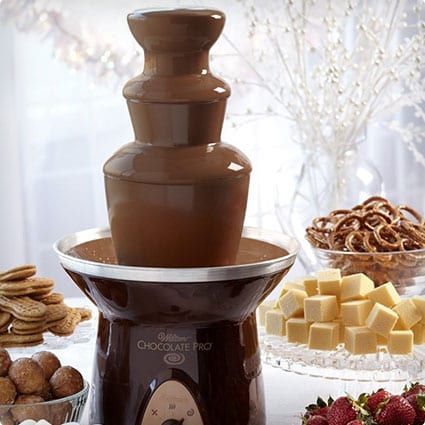
The width and height of the screenshot is (425, 425). What are the coordinates of `galss vase` in the screenshot? It's located at (340, 179).